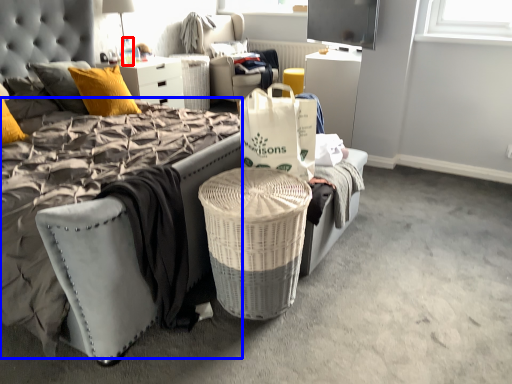
Question: Which point is closer to the camera, bottle (highlighted by a red box) or mattress (highlighted by a blue box)?

Choices:
 (A) bottle
 (B) mattress

Answer: (B)